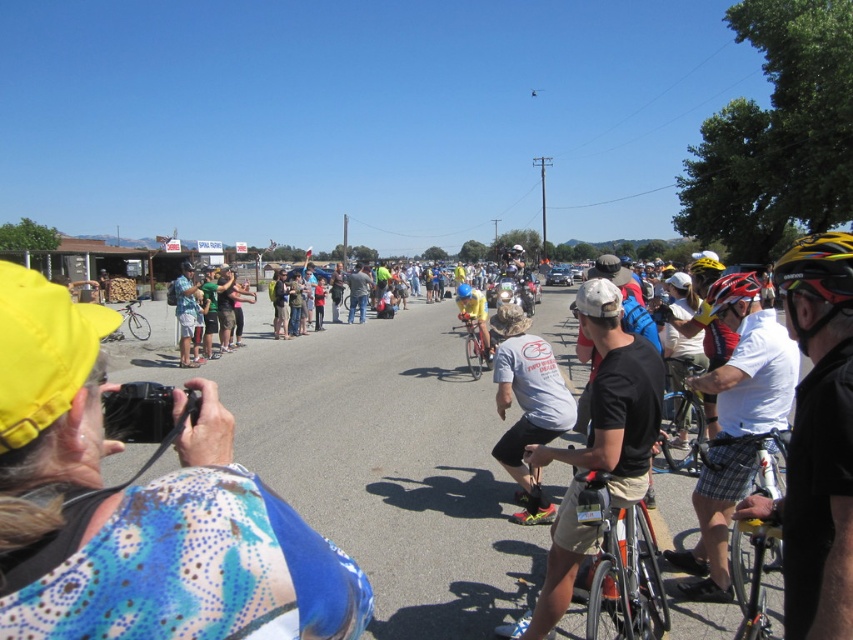
Question: Is white cotton t-shirt at center smaller than yellow matte bicycle helmet at center?

Choices:
 (A) no
 (B) yes

Answer: (B)

Question: Which of the following is the closest to the observer?

Choices:
 (A) (711, 308)
 (B) (483, 316)
 (C) (672, 365)
 (D) (567, 420)

Answer: (A)

Question: Which point is closer to the camera taking this photo?

Choices:
 (A) (543, 436)
 (B) (125, 321)
 (C) (701, 273)
 (D) (461, 291)

Answer: (A)

Question: Is silver metallic bicycle at lower right further to the viewer compared to yellow matte bicycle helmet at right?

Choices:
 (A) no
 (B) yes

Answer: (B)

Question: Does shiny silver bicycle at center have a larger size compared to matte yellow helmet at center?

Choices:
 (A) no
 (B) yes

Answer: (B)

Question: Estimate the real-world distances between objects in this image. Which object is closer to the silver metallic bicycle at center?

Choices:
 (A) yellow jersey at center
 (B) yellow matte bicycle helmet at right
 (C) shiny red bicycle at center

Answer: (B)